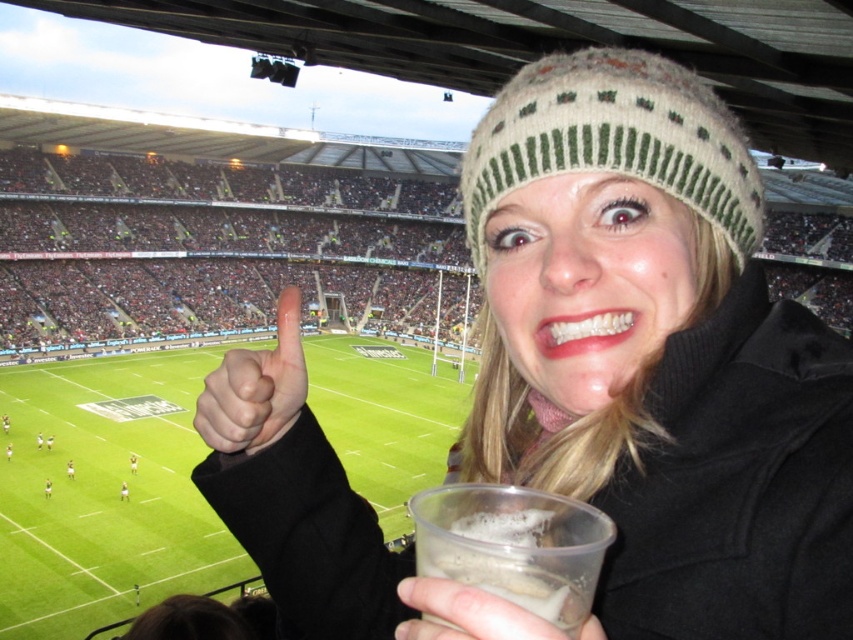
You are a photographer at the rugby stadium and want to capture a photo where both the knitted woolen hat at upper center and the translucent plastic cup at lower center are visible. Which object should you focus on first if you want to ensure both are in frame?

You should focus on the knitted woolen hat at upper center first because its width is larger than the translucent plastic cup at lower center, making it easier to frame both objects by centering the wider object first.

You are a photographer at the rugby stadium and want to capture both the white knit hat at upper center and the knitted woolen hat at upper center in the same photo. Which hat should you position your camera to the right of to ensure both are in frame?

You should position your camera to the right of the white knit hat at upper center since it is to the left of the knitted woolen hat at upper center, ensuring both are captured in the frame.

You are at a rugby stadium and notice two cups near the edge of the table. The translucent plastic cup at lower center and the clear plastic cup at lower center. Which one is closer to the edge of the table?

The clear plastic cup at lower center is closer to the edge of the table because the translucent plastic cup at lower center is located above it, meaning the clear one is lower and nearer to the edge.